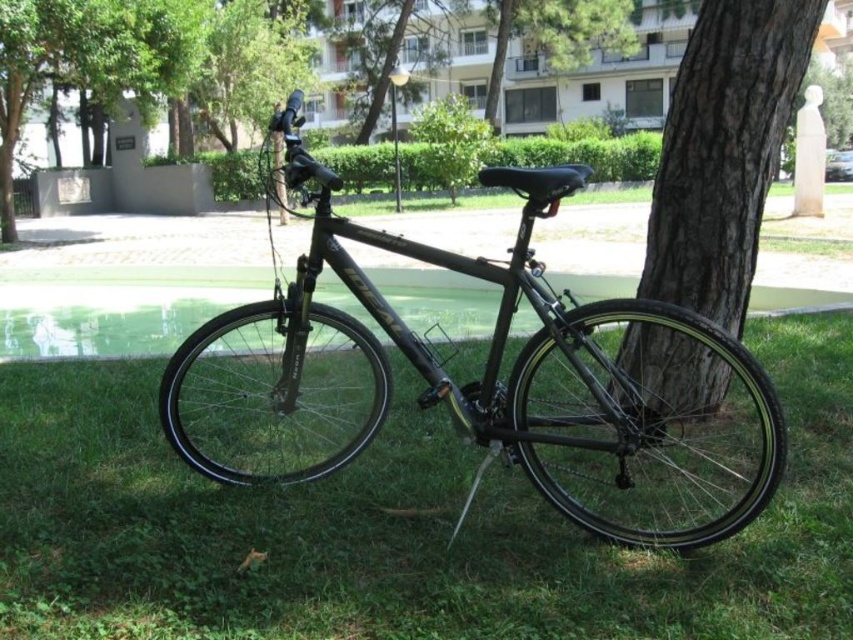
Question: Can you confirm if matte black bicycle at center is positioned below brown rough bark at center?

Choices:
 (A) no
 (B) yes

Answer: (B)

Question: Can you confirm if green grass at lower center is positioned below matte black bicycle at center?

Choices:
 (A) yes
 (B) no

Answer: (A)

Question: Which object is positioned farthest from the green grass at lower center?

Choices:
 (A) brown rough bark at center
 (B) matte black bicycle at center

Answer: (A)

Question: Which object is closer to the camera taking this photo?

Choices:
 (A) green grass at lower center
 (B) brown rough bark at center
 (C) matte black bicycle at center

Answer: (A)

Question: Does green grass at lower center appear over matte black bicycle at center?

Choices:
 (A) no
 (B) yes

Answer: (A)

Question: Which object is positioned closest to the brown rough bark at center?

Choices:
 (A) green grass at lower center
 (B) matte black bicycle at center

Answer: (B)